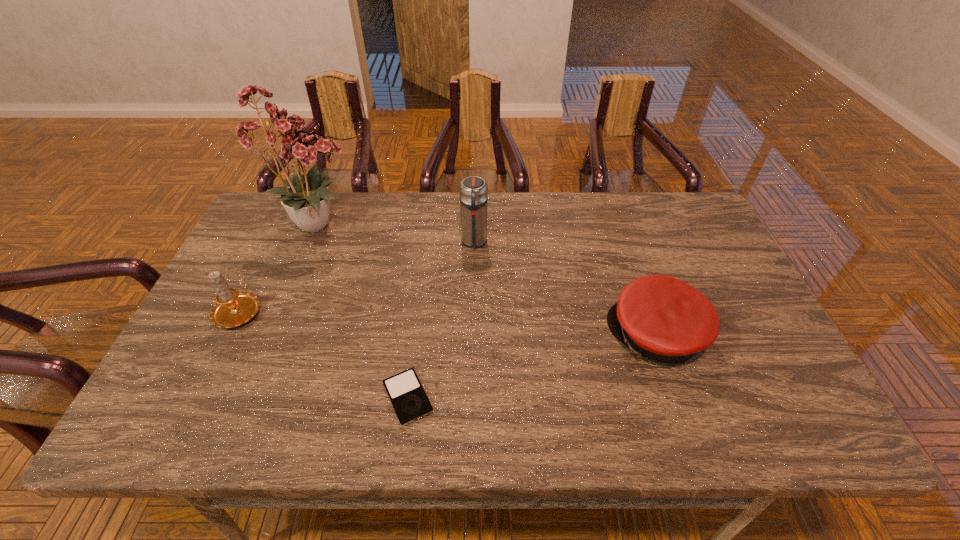
Locate an element on the screen. The image size is (960, 540). the tallest object is located at coordinates (307, 199).

You are a GUI agent. You are given a task and a screenshot of the screen. Output one action in this format:
    pyautogui.click(x=<x>, y=<y>)
    Task: Click on the fourth shortest object
    Image resolution: width=960 pixels, height=540 pixels.
    Given the screenshot: What is the action you would take?
    pyautogui.click(x=473, y=190)

Where is `thermos bottle`? The image size is (960, 540). thermos bottle is located at coordinates (473, 190).

Identify the location of candle. (233, 308).

Identify the location of the rightmost object. (660, 318).

In order to click on the fourth tallest object in this screenshot , I will do `click(660, 318)`.

The height and width of the screenshot is (540, 960). I want to click on iPod, so click(406, 393).

Image resolution: width=960 pixels, height=540 pixels. Identify the location of the third object from left to right. (406, 393).

You are a GUI agent. You are given a task and a screenshot of the screen. Output one action in this format:
    pyautogui.click(x=<x>, y=<y>)
    Task: Click on the vacant space situated 0.090m on the front-facing side of the flower arrangement
    The height and width of the screenshot is (540, 960).
    Given the screenshot: What is the action you would take?
    pyautogui.click(x=397, y=224)

This screenshot has height=540, width=960. Identify the location of vacant space located with a handle on the side of the thermos bottle. (472, 353).